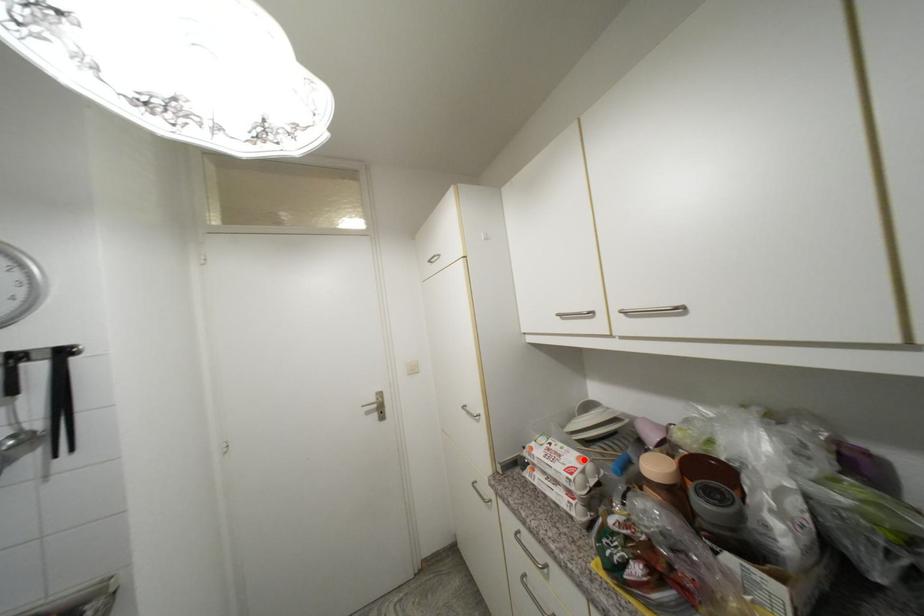
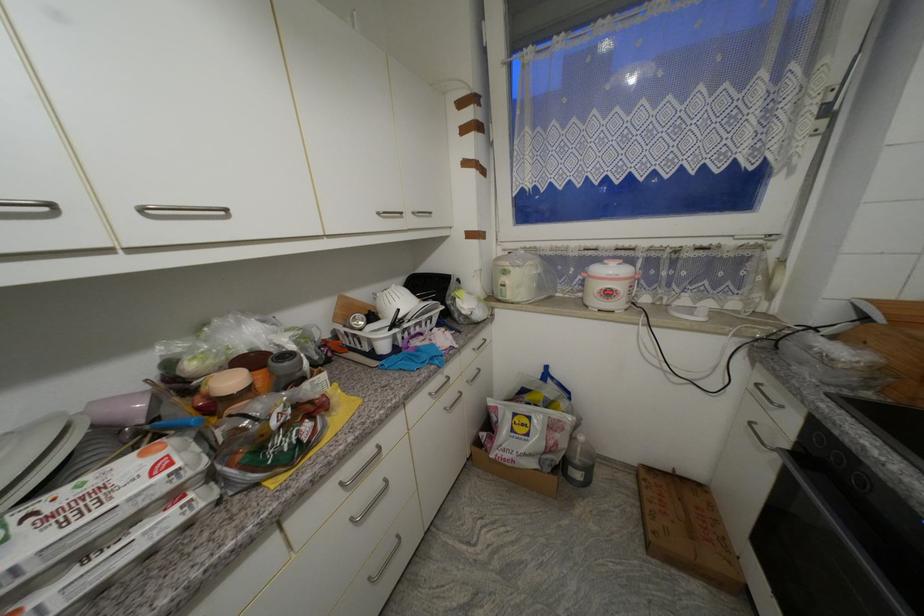
Where in the second image is the point corresponding to the highlighted location from the first image?

(149, 456)